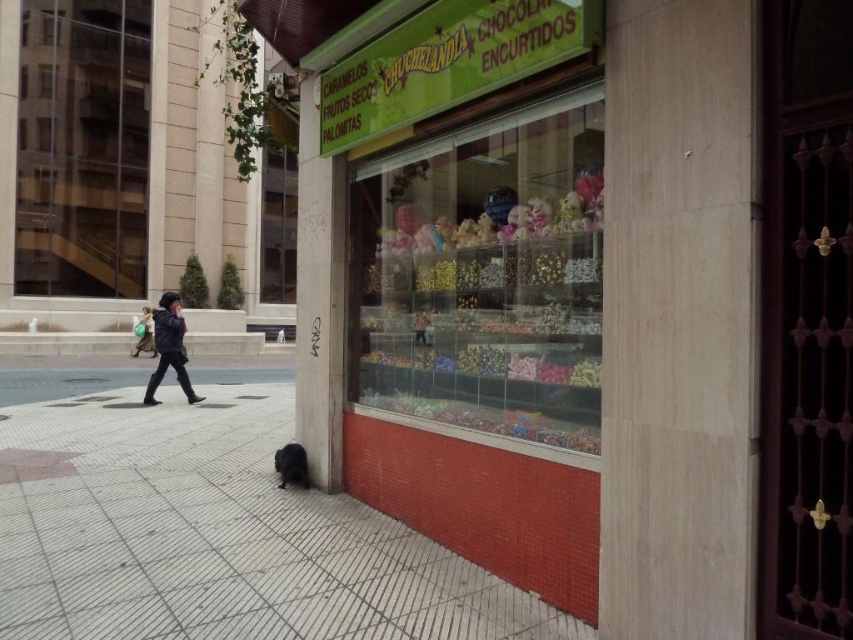
Does point (482, 292) come in front of point (165, 323)?

Yes.

Can you confirm if clear glass display case at center is bigger than black matte jacket at left?

Correct, clear glass display case at center is larger in size than black matte jacket at left.

Who is more distant from viewer, (506, 372) or (196, 397)?

Positioned behind is point (196, 397).

In order to click on clear glass display case at center in this screenshot , I will do `click(485, 275)`.

Which is more to the right, black tile pavement at lower left or black leather jacket at left?

black tile pavement at lower left is more to the right.

Based on the photo, can you confirm if black tile pavement at lower left is positioned to the left of black leather jacket at left?

No, black tile pavement at lower left is not to the left of black leather jacket at left.

Is point (177, 465) positioned behind point (144, 330)?

That is False.

The width and height of the screenshot is (853, 640). What are the coordinates of `black tile pavement at lower left` in the screenshot? It's located at (216, 534).

Which of these two, black matte jacket at left or black leather jacket at left, stands shorter?

Standing shorter between the two is black leather jacket at left.

Does black matte jacket at left have a lesser width compared to black leather jacket at left?

Yes.

Find the location of a particular element. The width and height of the screenshot is (853, 640). black matte jacket at left is located at coordinates (169, 348).